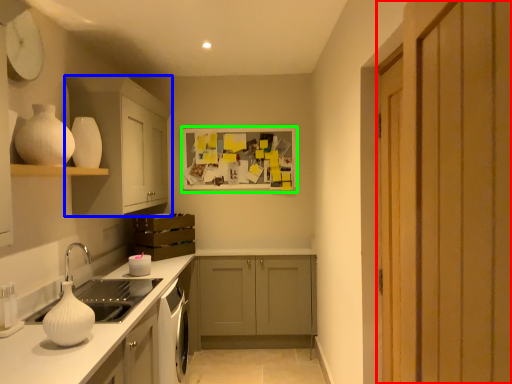
Question: Which is farther away from door (highlighted by a red box)? cabinetry (highlighted by a blue box) or picture frame (highlighted by a green box)?

Choices:
 (A) cabinetry
 (B) picture frame

Answer: (B)